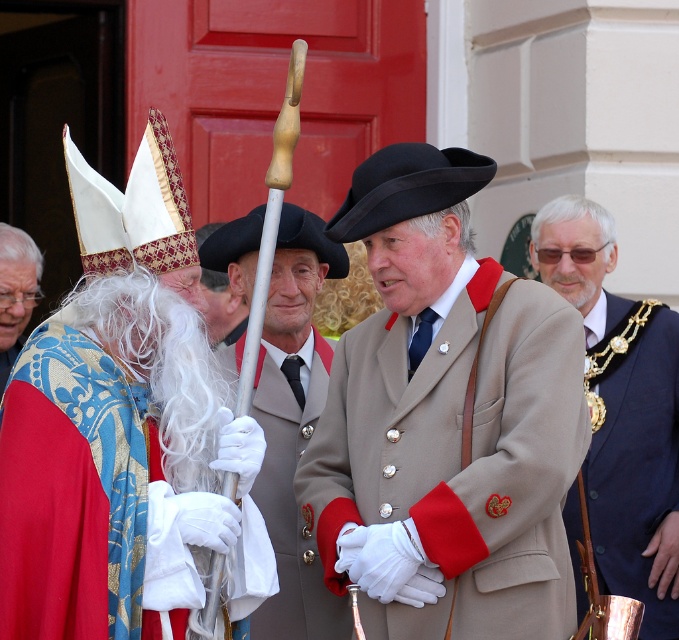
You are standing at the point marked as point (272, 412) and want to walk towards the red door in the background. Is there enough space between you and the red door to move freely?

The distance between you and the red door is 22.63 meters, so yes, there is enough space to move freely.

You are a photographer trying to capture the silver metallic staff at center without the gold chain at right appearing in the frame. Based on their positions, is this possible?

The silver metallic staff at center is behind the gold chain at right, so you can position yourself to capture the staff without the chain blocking it by moving to a side angle where the chain is out of view.

You are standing in front of the scene and want to know where the gold chain at right is located. Please describe its position using the coordinate system provided in the description.

The gold chain at right is located at the coordinate point 0.644 on the x axis and 0.916 on the y axis.